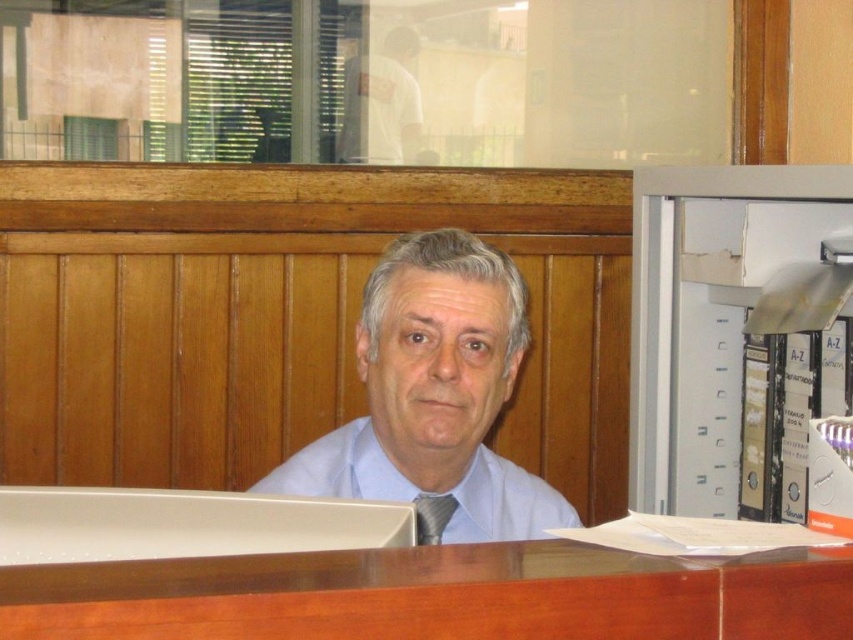
Who is shorter, light blue fabric dress shirt at center or matte black tie at center?

matte black tie at center is shorter.

Between point (561, 497) and point (445, 508), which one is positioned in front?

Point (445, 508) is in front.

Where is `light blue fabric dress shirt at center`? light blue fabric dress shirt at center is located at coordinates (503, 502).

Looking at this image, is white plastic file cabinet at right shorter than light blue fabric shirt at center?

Incorrect, white plastic file cabinet at right's height does not fall short of light blue fabric shirt at center's.

Which is in front, point (728, 182) or point (424, 369)?

Point (424, 369) is in front.

Where is `white plastic file cabinet at right`? The width and height of the screenshot is (853, 640). white plastic file cabinet at right is located at coordinates (735, 333).

Locate an element on the screen. white plastic file cabinet at right is located at coordinates (735, 333).

Is light blue fabric dress shirt at center taller than white cotton shirt at upper center?

In fact, light blue fabric dress shirt at center may be shorter than white cotton shirt at upper center.

In the scene shown: Between light blue fabric dress shirt at center and white cotton shirt at upper center, which one has more height?

Standing taller between the two is white cotton shirt at upper center.

The image size is (853, 640). In order to click on light blue fabric dress shirt at center in this screenshot , I will do `click(503, 502)`.

I want to click on light blue fabric dress shirt at center, so click(503, 502).